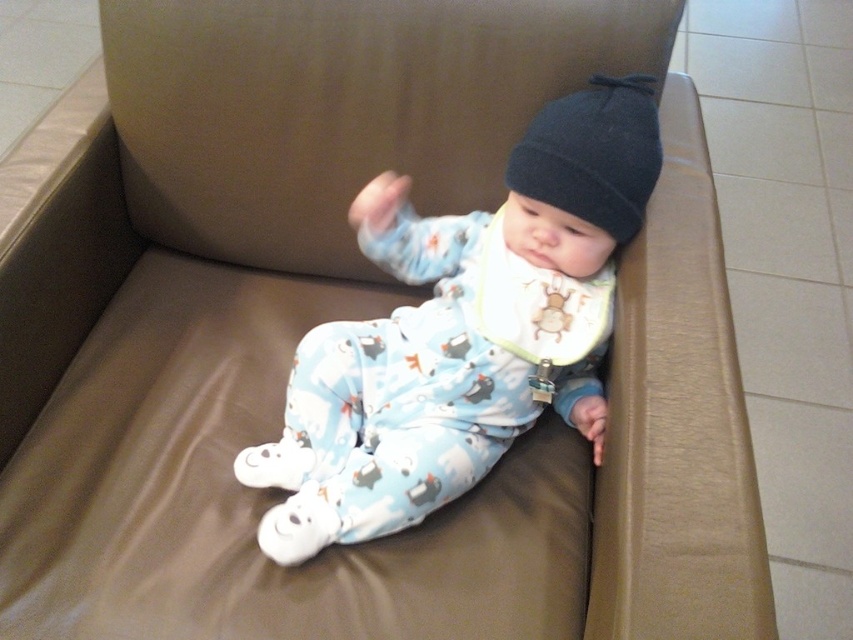
You are a photographer setting up for a baby photoshoot. You need to position a prop to the right of the black knit beanie at upper center so it appears in the same row as the blue cotton onesie at center. Where should you place the prop?

Place the prop to the right of the black knit beanie at upper center, aligning it horizontally with the blue cotton onesie at center so they are in the same row.

The baby is wearing a blue cotton onesie at center and a black knit beanie at upper center. Which clothing item is taller?

The blue cotton onesie at center is taller than the black knit beanie at upper center.

You are a photographer taking a picture of the baby on the couch. You notice two points in the image labeled as point 1 at coordinates point (444, 420) and point 2 at coordinates point (572, 173). Which point should you focus on to ensure the baby is in sharp focus?

Point 1 at coordinates point (444, 420) is further to the camera than point 2 at coordinates point (572, 173). Therefore, focusing on point 1 would ensure the baby is in sharp focus since it is closer to the camera.